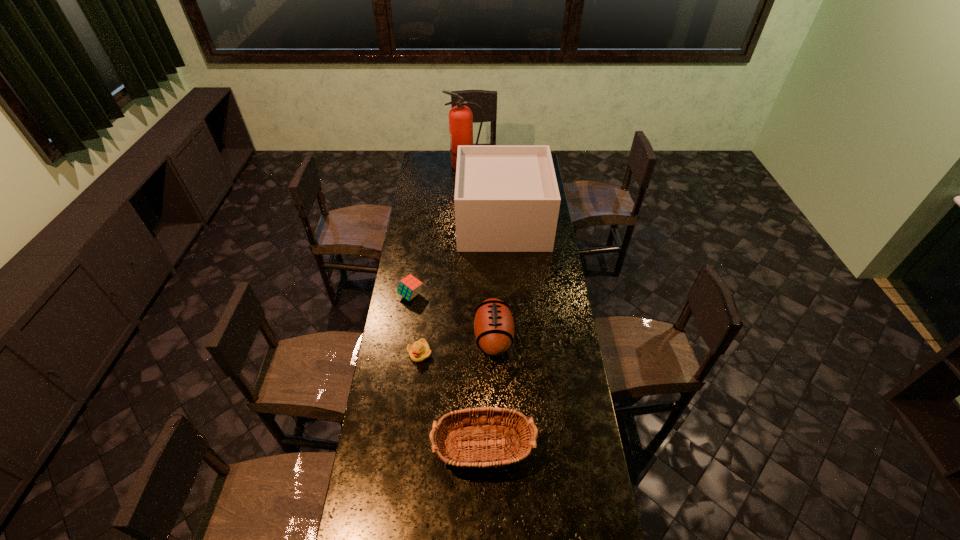
Identify which object is the third nearest to the second tallest object. Please provide its 2D coordinates. Your answer should be formatted as a tuple, i.e. [(x, y)], where the tuple contains the x and y coordinates of a point satisfying the conditions above.

[(493, 325)]

At what (x,y) coordinates should I click in order to perform the action: click on free location that satisfies the following two spatial constraints: 1. on the nozzle of the fire extinguisher; 2. on the left side of the basket. Please return your answer as a coordinate pair (x, y). Looking at the image, I should click on (452, 447).

You are a GUI agent. You are given a task and a screenshot of the screen. Output one action in this format:
    pyautogui.click(x=<x>, y=<y>)
    Task: Click on the vacant region that satisfies the following two spatial constraints: 1. on the front side of the fifth tallest object; 2. on the left side of the football (American)
    The height and width of the screenshot is (540, 960).
    Given the screenshot: What is the action you would take?
    pyautogui.click(x=405, y=337)